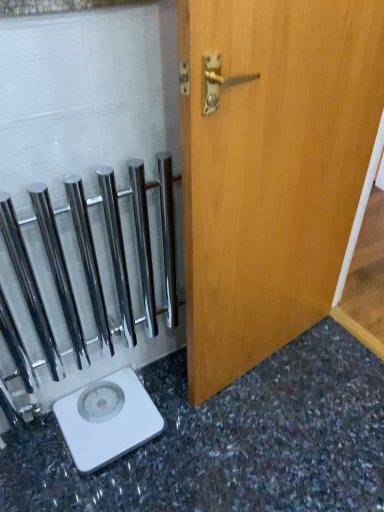
Find the location of a particular element. The image size is (384, 512). vacant space situated above granite gray surface at lower left (from a real-world perspective) is located at coordinates (233, 437).